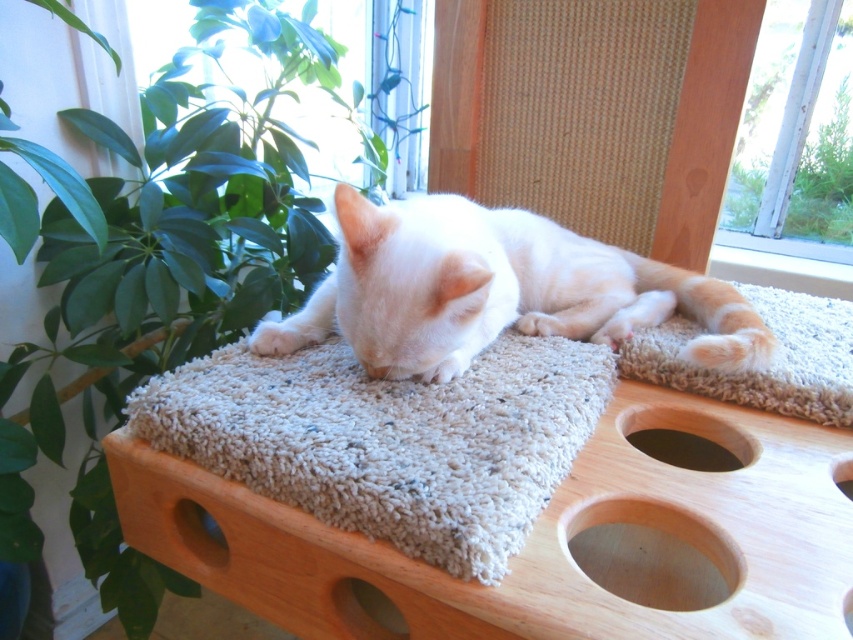
Question: Does white fluffy cat at center have a larger size compared to smooth light brown wooden hole at lower center?

Choices:
 (A) yes
 (B) no

Answer: (A)

Question: Which object appears farthest from the camera in this image?

Choices:
 (A) orange striped fur at center
 (B) smooth light brown wooden hole at lower center
 (C) green leafy plant at upper left

Answer: (C)

Question: Which of these objects is positioned closest to the orange striped fur at center?

Choices:
 (A) smooth brown hole at lower left
 (B) green leafy plant at upper left

Answer: (A)

Question: Does beige shaggy carpet at center have a greater width compared to white fluffy cat at center?

Choices:
 (A) yes
 (B) no

Answer: (B)

Question: Is smooth light brown wooden hole at lower center closer to camera compared to smooth dark wood hole at lower center?

Choices:
 (A) yes
 (B) no

Answer: (A)

Question: Which of the following is the closest to the observer?

Choices:
 (A) (177, 515)
 (B) (759, 376)

Answer: (A)